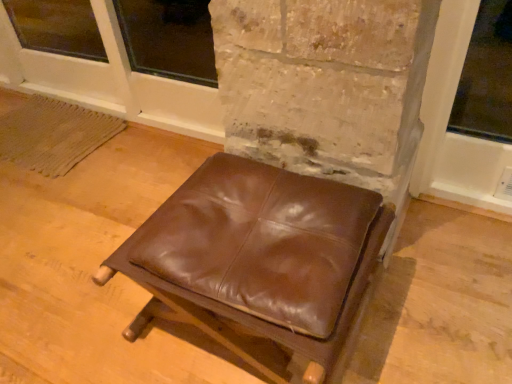
I want to click on vacant space to the right of brown leather ottoman at center, so click(x=430, y=293).